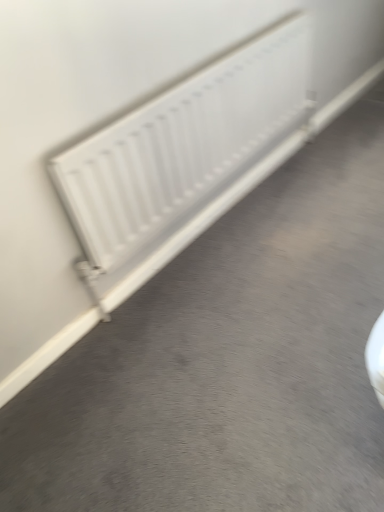
Identify the location of vacant region under white matte radiator at center (from a real-world perspective). The width and height of the screenshot is (384, 512). (227, 215).